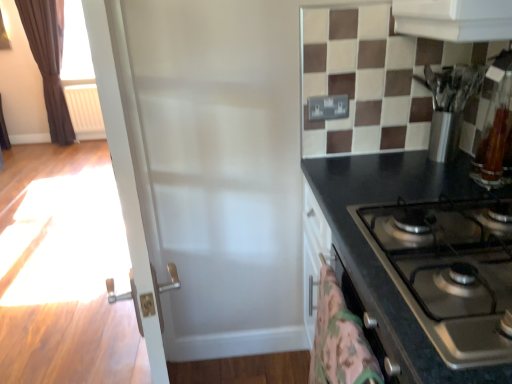
Question: From a real-world perspective, does brown velvet curtain at left stand above stainless steel knife block at upper right?

Choices:
 (A) yes
 (B) no

Answer: (B)

Question: Is there a large distance between brown velvet curtain at left and stainless steel knife block at upper right?

Choices:
 (A) no
 (B) yes

Answer: (B)

Question: Does brown velvet curtain at left have a greater width compared to stainless steel knife block at upper right?

Choices:
 (A) yes
 (B) no

Answer: (B)

Question: Is brown velvet curtain at left completely or partially outside of stainless steel knife block at upper right?

Choices:
 (A) yes
 (B) no

Answer: (A)

Question: Is brown velvet curtain at left bigger than stainless steel knife block at upper right?

Choices:
 (A) no
 (B) yes

Answer: (B)

Question: From a real-world perspective, is brown velvet curtain at left located beneath stainless steel knife block at upper right?

Choices:
 (A) yes
 (B) no

Answer: (A)

Question: Is white plastic radiator at left looking in the opposite direction of stainless steel knife block at upper right?

Choices:
 (A) no
 (B) yes

Answer: (A)

Question: Is white plastic radiator at left not inside stainless steel knife block at upper right?

Choices:
 (A) yes
 (B) no

Answer: (A)

Question: Is white plastic radiator at left further to the viewer compared to stainless steel knife block at upper right?

Choices:
 (A) no
 (B) yes

Answer: (B)

Question: Can stainless steel knife block at upper right be found inside white plastic radiator at left?

Choices:
 (A) no
 (B) yes

Answer: (A)

Question: Would you say white plastic radiator at left is a long distance from stainless steel knife block at upper right?

Choices:
 (A) yes
 (B) no

Answer: (A)

Question: Is white plastic radiator at left oriented towards stainless steel knife block at upper right?

Choices:
 (A) no
 (B) yes

Answer: (A)

Question: From a real-world perspective, is fluffy pink blanket at lower right located higher than brown velvet curtain at left?

Choices:
 (A) yes
 (B) no

Answer: (B)